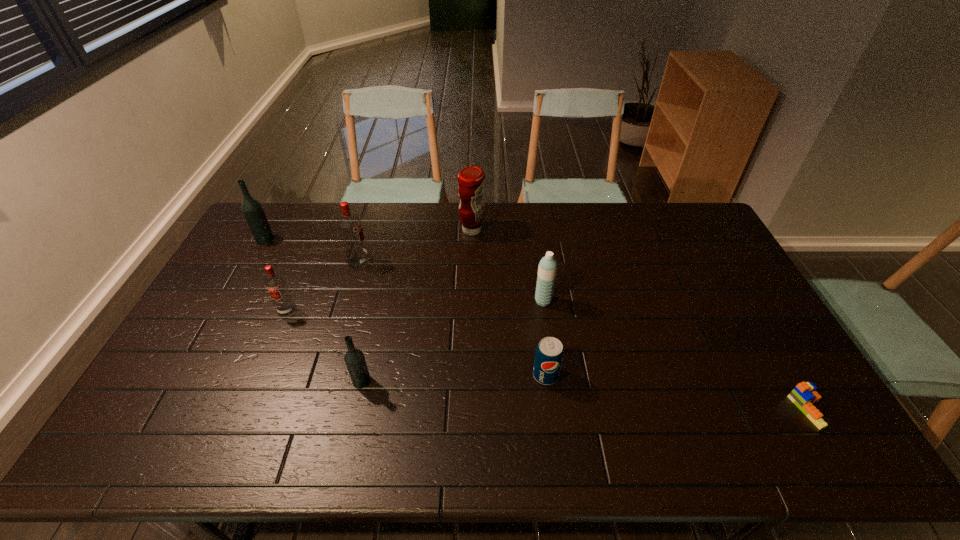
You are a GUI agent. You are given a task and a screenshot of the screen. Output one action in this format:
    pyautogui.click(x=<x>, y=<y>)
    Task: Click on the nearest vodka
    The height and width of the screenshot is (540, 960).
    Given the screenshot: What is the action you would take?
    pyautogui.click(x=354, y=358)

The width and height of the screenshot is (960, 540). Identify the location of pop. (549, 354).

Where is `the seventh tallest object`? Image resolution: width=960 pixels, height=540 pixels. the seventh tallest object is located at coordinates (549, 354).

I want to click on the shortest object, so click(804, 395).

Where is `the rightmost object`? Image resolution: width=960 pixels, height=540 pixels. the rightmost object is located at coordinates (804, 395).

Locate an element on the screen. The image size is (960, 540). free space located 0.320m on the right of the fourth object from right to left is located at coordinates (571, 230).

The width and height of the screenshot is (960, 540). I want to click on vacant region located on the right of the farther black vodka, so click(371, 239).

Where is `vacant space located 0.280m on the front label of the second farthest vodka`? vacant space located 0.280m on the front label of the second farthest vodka is located at coordinates (451, 262).

At what (x,y) coordinates should I click in order to perform the action: click on free space located on the back of the blue water bottle. Please return your answer as a coordinate pair (x, y). The image size is (960, 540). Looking at the image, I should click on (536, 246).

This screenshot has height=540, width=960. Find the location of `free spot located on the front label of the third vodka from right to left`. free spot located on the front label of the third vodka from right to left is located at coordinates (238, 426).